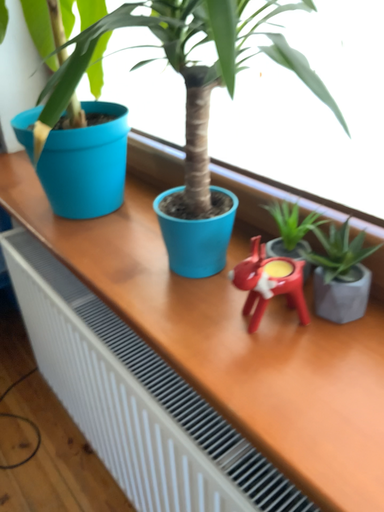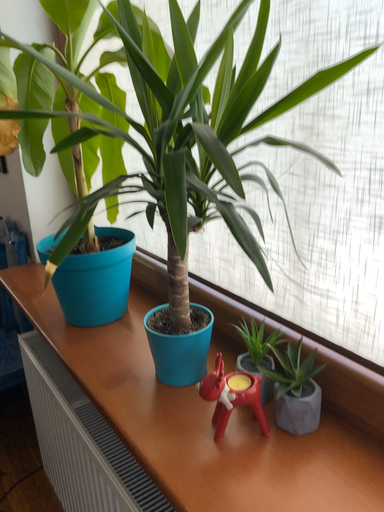
Question: How did the camera likely rotate when shooting the video?

Choices:
 (A) rotated downward
 (B) rotated upward

Answer: (B)